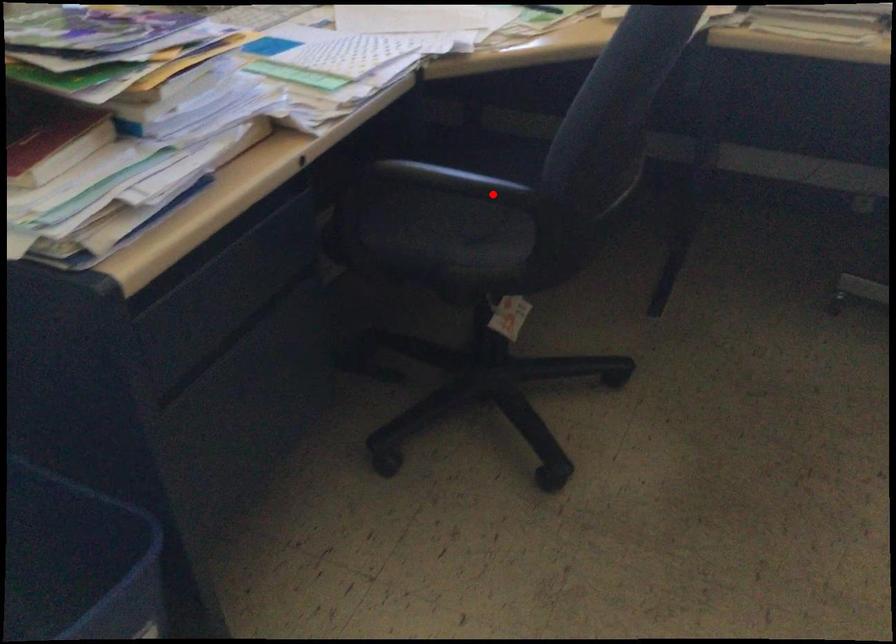
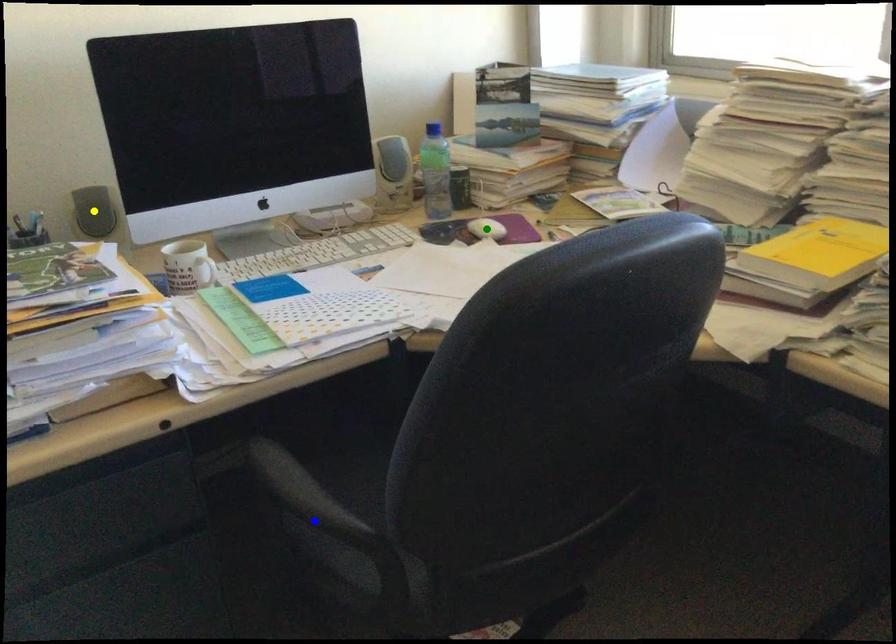
Question: I am providing you with two images of the same scene from different viewpoints. A red point is marked on the first image. You are given multiple points on the second image. In image 2, which mark is for the same physical point as the one in image 1?

Choices:
 (A) yellow point
 (B) blue point
 (C) green point

Answer: (B)